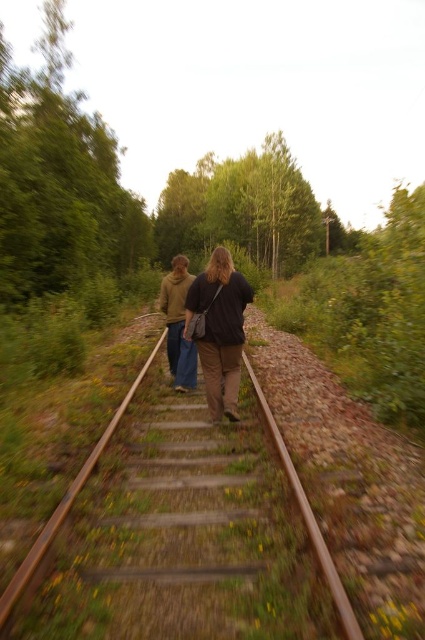
You are standing at the point where the two people are walking along the railway tracks. You want to know how far the point at coordinates (232, 324) is from you. Can you determine the distance?

The point at coordinates (232, 324) is 5.19 meters away from you.

Based on the photo, you are a hiker who wants to take a photo of the brown cotton hoodie at center and the rusty metal train track at center from the current position. Which object will appear closer to the camera in the photo?

The rusty metal train track at center is in front of the brown cotton hoodie at center, so it will appear closer to the camera in the photo.

You are standing at the origin point of the coordinate system. You want to walk to the rusty metal train track at center. In which direction should you move?

The rusty metal train track at center is located at coordinate point 0.834 in the x direction and 0.424 in the y direction. Since the origin is at the bottom left corner, you should move to the right and slightly upwards to reach the rusty metal train track at center.